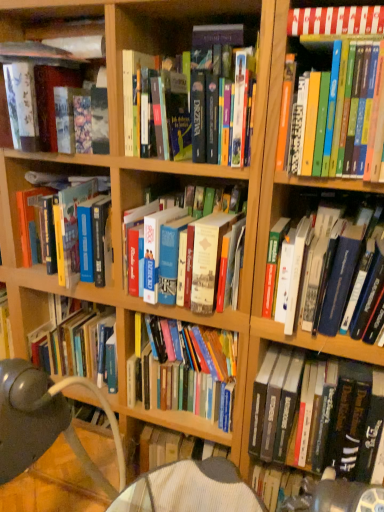
Question: Can hardcover book at center, marked as the seventh book in a bottom-to-top arrangement, be found inside hardcover books at upper right, acting as the sixth book starting from the bottom?

Choices:
 (A) yes
 (B) no

Answer: (B)

Question: Does hardcover books at upper right, acting as the sixth book starting from the bottom, have a larger size compared to hardcover book at center, marked as the 3th book in a top-to-bottom arrangement?

Choices:
 (A) no
 (B) yes

Answer: (A)

Question: Considering the relative sizes of hardcover books at upper right, acting as the sixth book starting from the bottom, and hardcover book at center, marked as the 3th book in a top-to-bottom arrangement, in the image provided, is hardcover books at upper right, acting as the sixth book starting from the bottom, thinner than hardcover book at center, marked as the 3th book in a top-to-bottom arrangement,?

Choices:
 (A) no
 (B) yes

Answer: (A)

Question: From a real-world perspective, is hardcover books at upper right, acting as the fourth book starting from the top, positioned over hardcover book at center, marked as the seventh book in a bottom-to-top arrangement, based on gravity?

Choices:
 (A) no
 (B) yes

Answer: (A)

Question: Does hardcover books at upper right, acting as the fourth book starting from the top, lie behind hardcover book at center, marked as the seventh book in a bottom-to-top arrangement?

Choices:
 (A) yes
 (B) no

Answer: (B)

Question: Is hardcover book at center, the 2th book positioned from the bottom, in front of or behind hardcover book at center, which is counted as the 1th book, starting from the bottom, in the image?

Choices:
 (A) front
 (B) behind

Answer: (B)

Question: From a real-world perspective, is hardcover book at center, which is the eighth book in top-to-bottom order, positioned above or below hardcover book at center, which is counted as the 1th book, starting from the bottom?

Choices:
 (A) above
 (B) below

Answer: (A)

Question: Would you say hardcover book at center, which is the eighth book in top-to-bottom order, is inside or outside hardcover book at center, which is counted as the 1th book, starting from the bottom?

Choices:
 (A) inside
 (B) outside

Answer: (B)

Question: Does point (203, 336) appear closer or farther from the camera than point (327, 437)?

Choices:
 (A) farther
 (B) closer

Answer: (A)

Question: From a real-world perspective, is hardcover book at center, the 5th book when ordered from bottom to top, positioned above or below hardcover books at center, the 6th book viewed from the top?

Choices:
 (A) above
 (B) below

Answer: (A)

Question: Choose the correct answer: Is hardcover book at center, the 5th book when ordered from bottom to top, inside hardcover books at center, the 6th book viewed from the top, or outside it?

Choices:
 (A) inside
 (B) outside

Answer: (B)

Question: Considering the positions of hardcover book at center, arranged as the fifth book when viewed from the top, and hardcover books at center, the 6th book viewed from the top, in the image, is hardcover book at center, arranged as the fifth book when viewed from the top, wider or thinner than hardcover books at center, the 6th book viewed from the top,?

Choices:
 (A) thin
 (B) wide

Answer: (B)

Question: From the image's perspective, is hardcover book at center, arranged as the fifth book when viewed from the top, located above or below hardcover books at center, which ranks as the fourth book in bottom-to-top order?

Choices:
 (A) below
 (B) above

Answer: (B)

Question: Is hardcover book at center, marked as the 3th book in a top-to-bottom arrangement, in front of or behind hardcover book at center, which is counted as the 1th book, starting from the bottom, in the image?

Choices:
 (A) behind
 (B) front

Answer: (B)

Question: In the image, is hardcover book at center, marked as the 3th book in a top-to-bottom arrangement, on the left side or the right side of hardcover book at center, which is counted as the 1th book, starting from the bottom?

Choices:
 (A) right
 (B) left

Answer: (B)